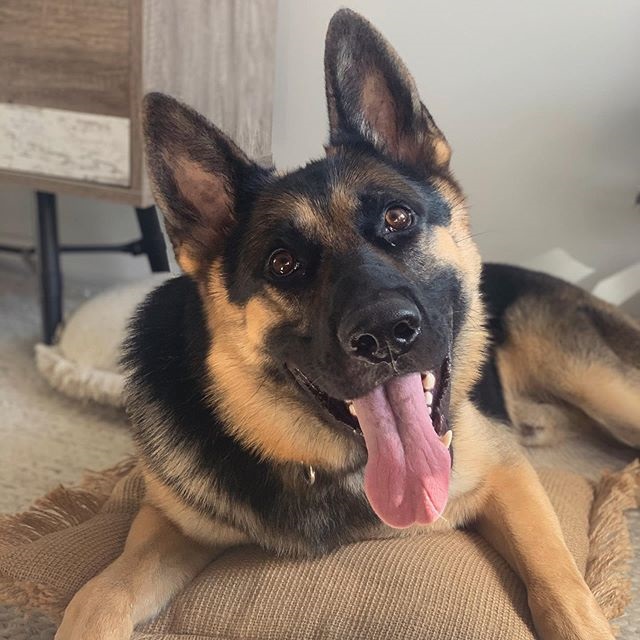
At what (x,y) coordinates should I click in order to perform the action: click on gold pillow. Please return your answer as a coordinate pair (x, y). Image resolution: width=640 pixels, height=640 pixels. Looking at the image, I should click on (442, 573), (372, 616).